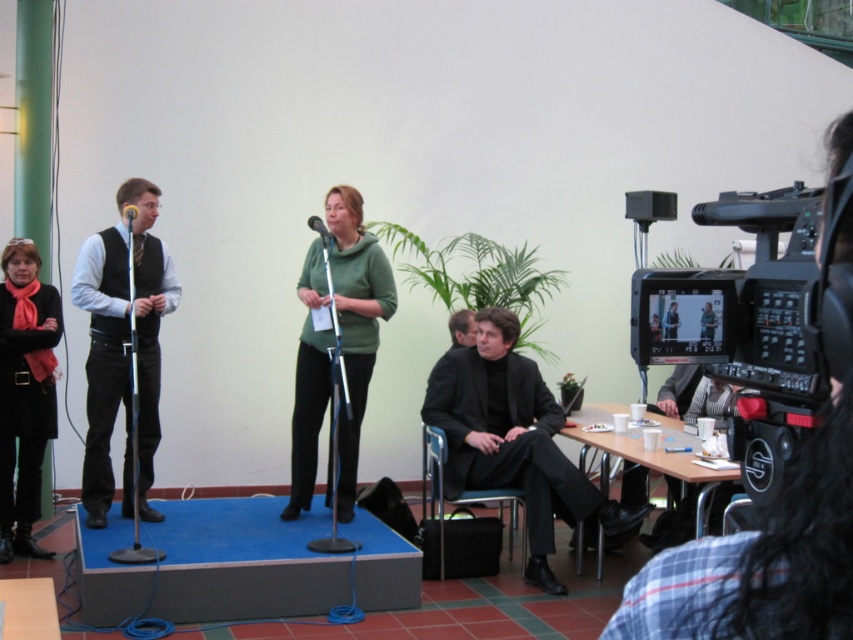
Question: Which object appears farthest from the camera in this image?

Choices:
 (A) matte black vest at left
 (B) matte black microphone at center
 (C) green matte sweater at center
 (D) black matte suit at center

Answer: (D)

Question: In this image, where is matte black vest at left located relative to matte black microphone at center?

Choices:
 (A) below
 (B) above

Answer: (A)

Question: Can you confirm if green matte sweater at center is positioned below black wool coat at lower left?

Choices:
 (A) no
 (B) yes

Answer: (A)

Question: Which is nearer to the matte black microphone at center?

Choices:
 (A) matte black vest at left
 (B) black matte suit at center

Answer: (A)

Question: Is black matte suit at center further to the viewer compared to matte black vest at left?

Choices:
 (A) yes
 (B) no

Answer: (A)

Question: Which object is the farthest from the matte black microphone at center?

Choices:
 (A) metallic silver microphone at left
 (B) matte black vest at left
 (C) black matte suit at center
 (D) black wool coat at lower left

Answer: (D)